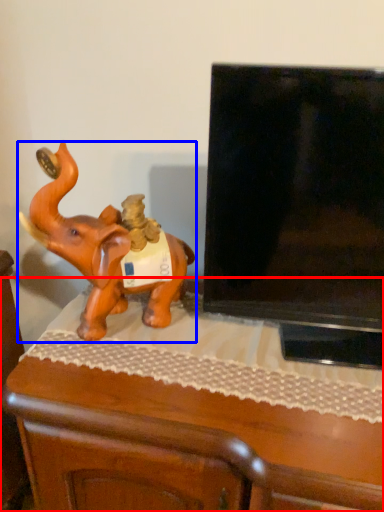
Question: Which object appears closest to the camera in this image, furniture (highlighted by a red box) or elephant (highlighted by a blue box)?

Choices:
 (A) furniture
 (B) elephant

Answer: (A)